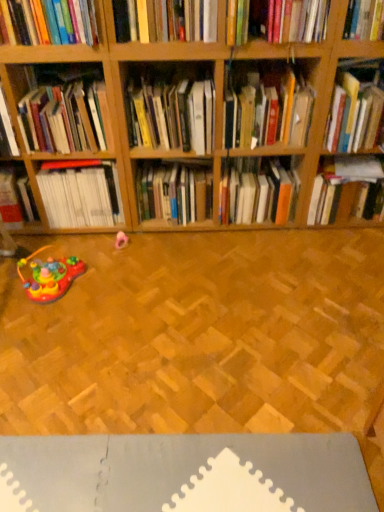
Locate an element on the screen. free space that is to the left of rubberized plastic toy at lower left, the 1th toy when ordered from bottom to top is located at coordinates (11, 282).